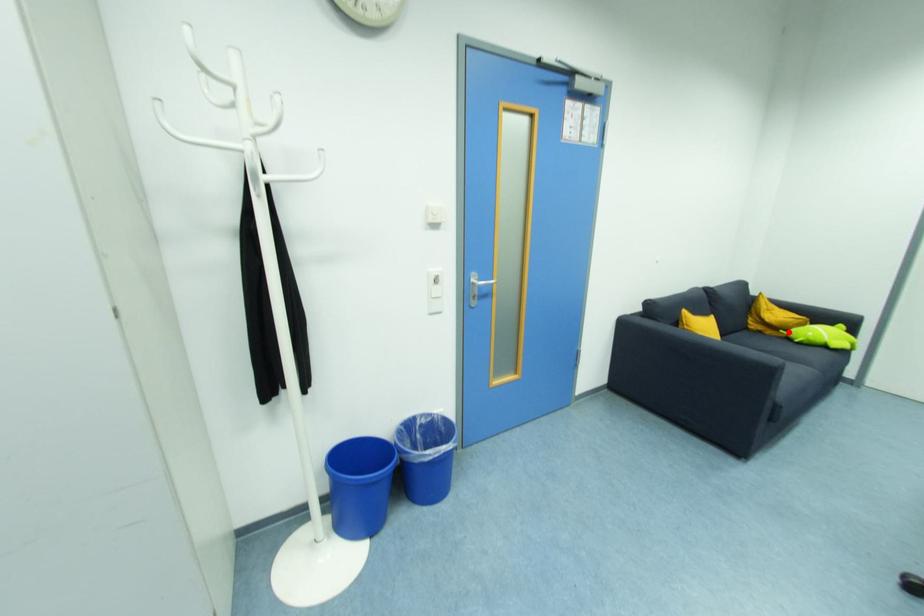
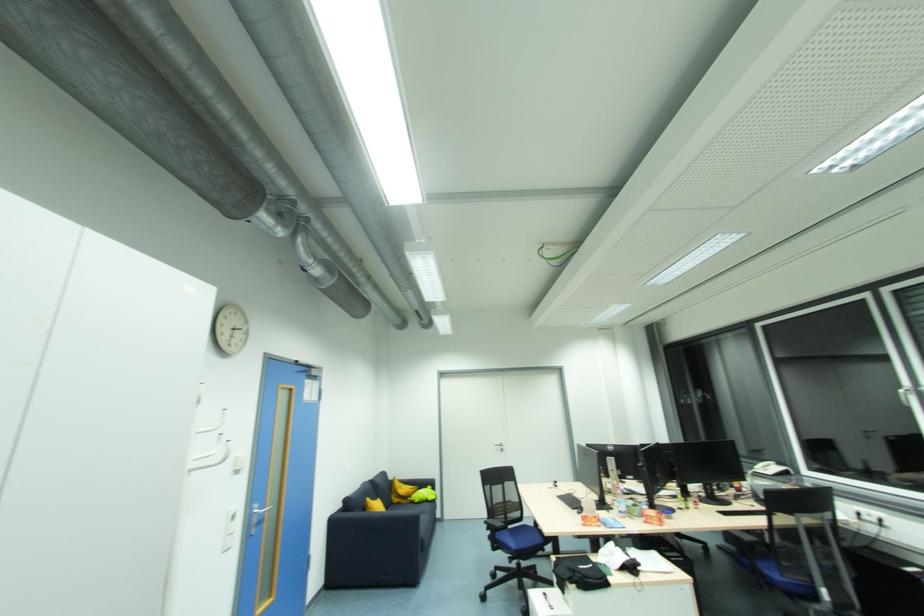
In the second image, find the point that corresponds to the highlighted location in the first image.

(412, 499)